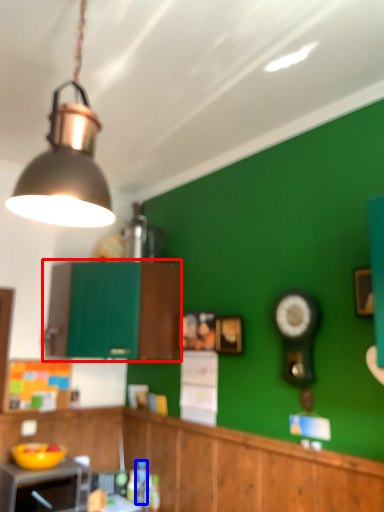
Question: Which object is closer to the camera taking this photo, cabinetry (highlighted by a red box) or bottle (highlighted by a blue box)?

Choices:
 (A) cabinetry
 (B) bottle

Answer: (A)